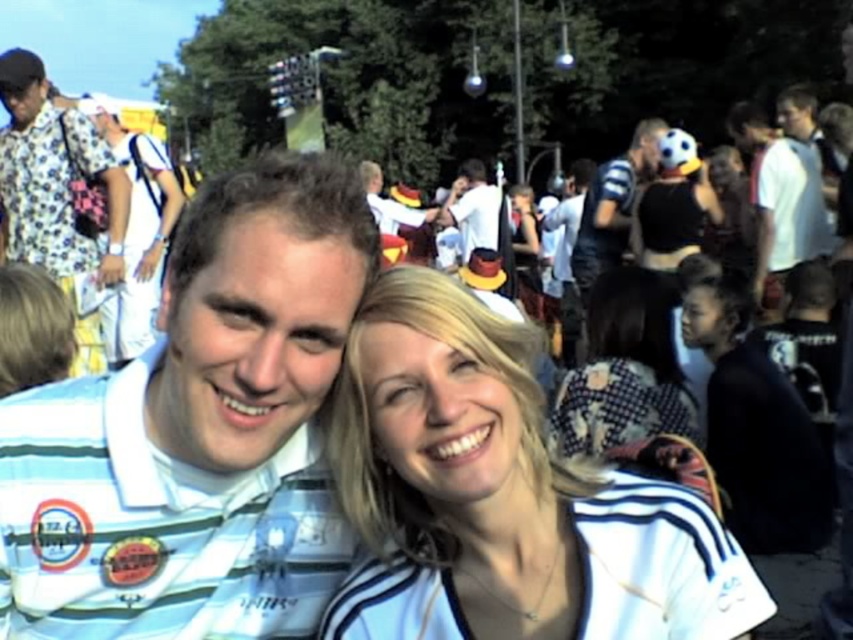
Between white striped polo shirt at center and striped fabric scarf at center, which one appears on the right side from the viewer's perspective?

From the viewer's perspective, striped fabric scarf at center appears more on the right side.

Does white striped polo shirt at center have a smaller size compared to striped fabric scarf at center?

Yes.

Is point (300, 467) more distant than point (700, 470)?

No.

Find the location of a particular element. This screenshot has height=640, width=853. white striped polo shirt at center is located at coordinates (198, 433).

Does white matte jacket at center have a greater height compared to white cotton shirt at left?

No.

Which is above, white matte jacket at center or white cotton shirt at left?

white cotton shirt at left is higher up.

Which is behind, point (466, 564) or point (155, 216)?

Point (155, 216)

In order to click on white matte jacket at center in this screenshot , I will do `click(502, 497)`.

Between point (717, 369) and point (115, 148), which one is positioned in front?

Point (717, 369) is more forward.

What do you see at coordinates (756, 432) in the screenshot? Image resolution: width=853 pixels, height=640 pixels. I see `black matte jacket at lower right` at bounding box center [756, 432].

The width and height of the screenshot is (853, 640). I want to click on black matte jacket at lower right, so click(756, 432).

At what (x,y) coordinates should I click in order to perform the action: click on black matte jacket at lower right. Please return your answer as a coordinate pair (x, y). Looking at the image, I should click on (756, 432).